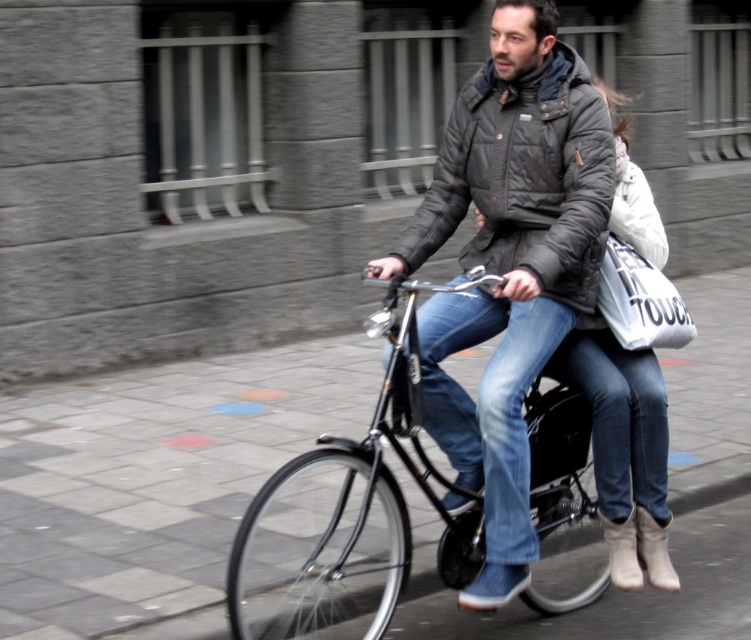
Question: Which of the following is the farthest from the observer?

Choices:
 (A) (611, 449)
 (B) (469, 468)
 (C) (559, 212)
 (D) (653, 273)

Answer: (D)

Question: Which object is farther from the camera taking this photo?

Choices:
 (A) black matte bicycle at center
 (B) black quilted jacket at center

Answer: (B)

Question: Where is black quilted jacket at center located in relation to white fabric bag at center in the image?

Choices:
 (A) above
 (B) below

Answer: (A)

Question: Can you confirm if black matte bicycle at center is positioned below black quilted jacket at center?

Choices:
 (A) no
 (B) yes

Answer: (B)

Question: Among these objects, which one is farthest from the camera?

Choices:
 (A) white fabric bag at center
 (B) matte black jacket at center

Answer: (A)

Question: Does matte black jacket at center appear on the right side of black matte bicycle at center?

Choices:
 (A) no
 (B) yes

Answer: (B)